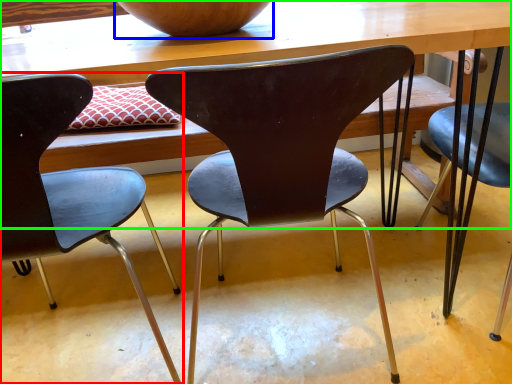
Question: Considering the real-world distances, which object is closest to chair (highlighted by a red box)? bowl (highlighted by a blue box) or table (highlighted by a green box).

Choices:
 (A) bowl
 (B) table

Answer: (B)